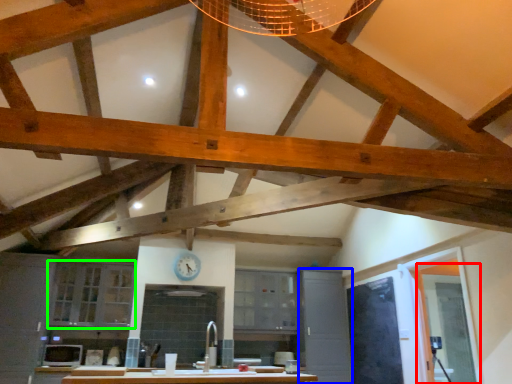
Question: Which object is the closest to the glass door (highlighted by a red box)? Choose among these: cabinetry (highlighted by a blue box) or cabinetry (highlighted by a green box).

Choices:
 (A) cabinetry
 (B) cabinetry

Answer: (A)